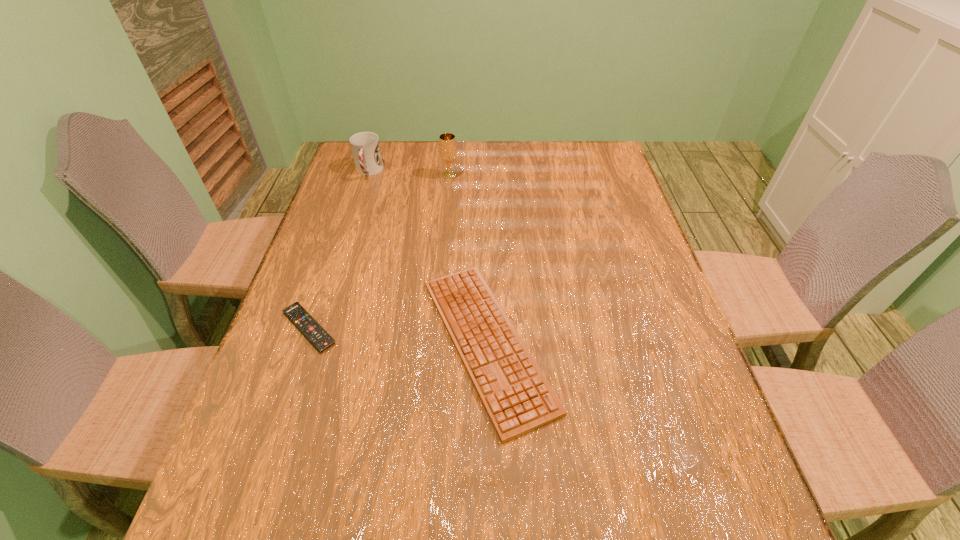
The image size is (960, 540). Find the location of `free space between the computer keyboard and the cup`. free space between the computer keyboard and the cup is located at coordinates (428, 257).

Identify the location of free space between the remote control and the third tallest object. (398, 335).

Find the location of a particular element. free space between the chalice and the third tallest object is located at coordinates (468, 259).

I want to click on free space that is in between the computer keyboard and the shortest object, so click(398, 335).

Image resolution: width=960 pixels, height=540 pixels. I want to click on vacant space that's between the chalice and the second shortest object, so click(468, 259).

I want to click on free point between the cup and the shortest object, so click(x=339, y=249).

Find the location of a particular element. The height and width of the screenshot is (540, 960). free space that is in between the computer keyboard and the tallest object is located at coordinates (468, 259).

Where is `free space between the tallest object and the second shortest object`? free space between the tallest object and the second shortest object is located at coordinates (468, 259).

Find the location of a particular element. The image size is (960, 540). vacant region between the remote control and the second tallest object is located at coordinates pyautogui.click(x=339, y=249).

Locate an element on the screen. object that is the third closest one to the second tallest object is located at coordinates (314, 332).